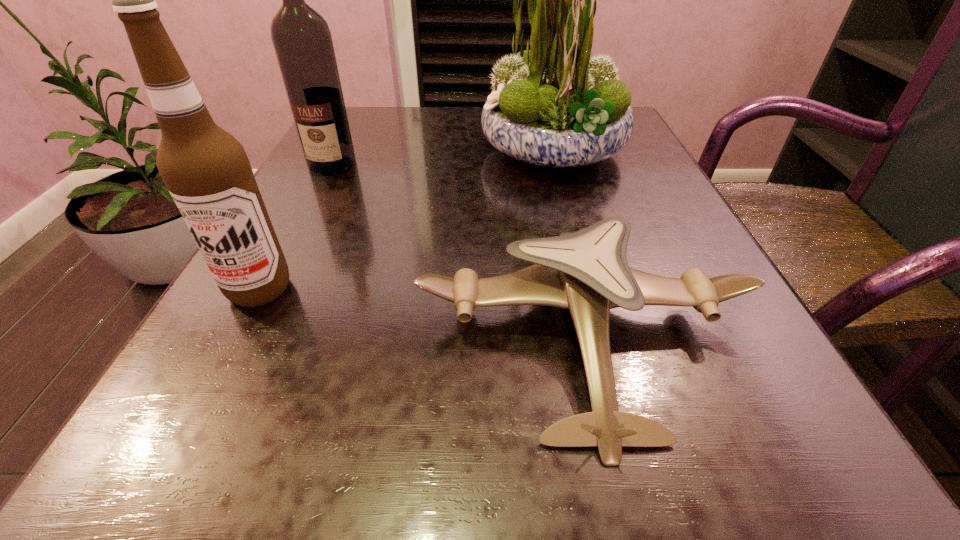
You are a GUI agent. You are given a task and a screenshot of the screen. Output one action in this format:
    pyautogui.click(x=<x>, y=<y>)
    Task: Click on the free spot between the flower arrangement and the farther alcohol
    This screenshot has height=540, width=960.
    Given the screenshot: What is the action you would take?
    pyautogui.click(x=443, y=158)

Where is `free space between the nearer alcohol and the farther alcohol`? The image size is (960, 540). free space between the nearer alcohol and the farther alcohol is located at coordinates (297, 227).

Locate an element on the screen. Image resolution: width=960 pixels, height=540 pixels. free space that is in between the nearer alcohol and the flower arrangement is located at coordinates (407, 220).

Identify the location of free space between the flower arrangement and the nearer alcohol. (407, 220).

Identify the location of free space between the nearer alcohol and the farther alcohol. The height and width of the screenshot is (540, 960). (297, 227).

The width and height of the screenshot is (960, 540). Find the location of `free space between the drone and the nearer alcohol`. free space between the drone and the nearer alcohol is located at coordinates (421, 313).

Locate which object ranks second in proximity to the farther alcohol. Please provide its 2D coordinates. Your answer should be formatted as a tuple, i.e. [(x, y)], where the tuple contains the x and y coordinates of a point satisfying the conditions above.

[(206, 170)]

Identify which object is the second nearest to the flower arrangement. Please provide its 2D coordinates. Your answer should be formatted as a tuple, i.e. [(x, y)], where the tuple contains the x and y coordinates of a point satisfying the conditions above.

[(301, 37)]

The image size is (960, 540). I want to click on vacant area in the image that satisfies the following two spatial constraints: 1. on the front-facing side of the flower arrangement; 2. on the front and back of the farther alcohol, so click(558, 165).

Where is `vacant region that satisfies the following two spatial constraints: 1. on the front-facing side of the flower arrangement; 2. on the front and back of the farther alcohol`? vacant region that satisfies the following two spatial constraints: 1. on the front-facing side of the flower arrangement; 2. on the front and back of the farther alcohol is located at coordinates (558, 165).